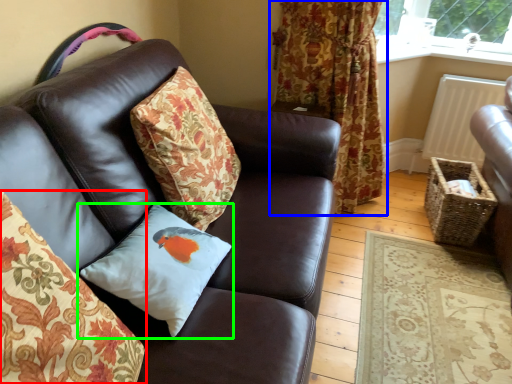
Question: Estimate the real-world distances between objects in this image. Which object is farther from pillow (highlighted by a red box), curtain (highlighted by a blue box) or pillow (highlighted by a green box)?

Choices:
 (A) curtain
 (B) pillow

Answer: (A)